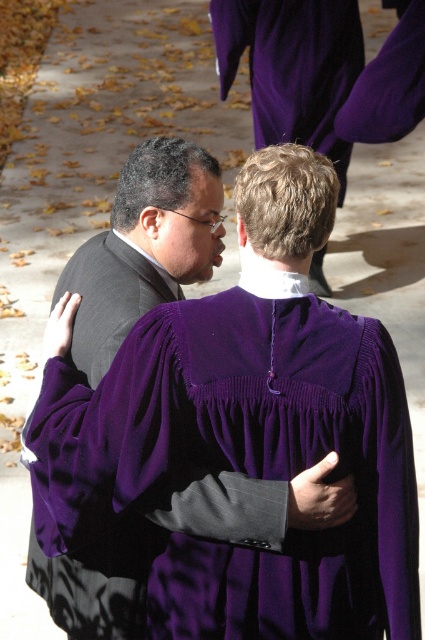
Question: Which of the following is the farthest from the observer?

Choices:
 (A) purple velvet gown at center
 (B) velvet purple robe at center

Answer: (B)

Question: Where is purple velvet gown at center located in relation to velvet purple robe at center in the image?

Choices:
 (A) right
 (B) left

Answer: (A)

Question: Is purple velvet gown at center further to the viewer compared to velvet purple robe at center?

Choices:
 (A) no
 (B) yes

Answer: (A)

Question: Which of the following is the closest to the observer?

Choices:
 (A) (232, 417)
 (B) (99, 598)

Answer: (A)

Question: Does purple velvet gown at center have a greater width compared to velvet purple robe at center?

Choices:
 (A) no
 (B) yes

Answer: (B)

Question: Which point is closer to the camera?

Choices:
 (A) (198, 198)
 (B) (104, 396)

Answer: (B)